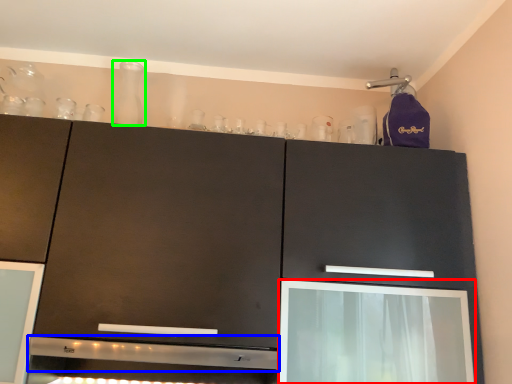
Question: Estimate the real-world distances between objects in this image. Which object is farther from screen door (highlighted by a red box), exhaust hood (highlighted by a blue box) or glass vase (highlighted by a green box)?

Choices:
 (A) exhaust hood
 (B) glass vase

Answer: (B)